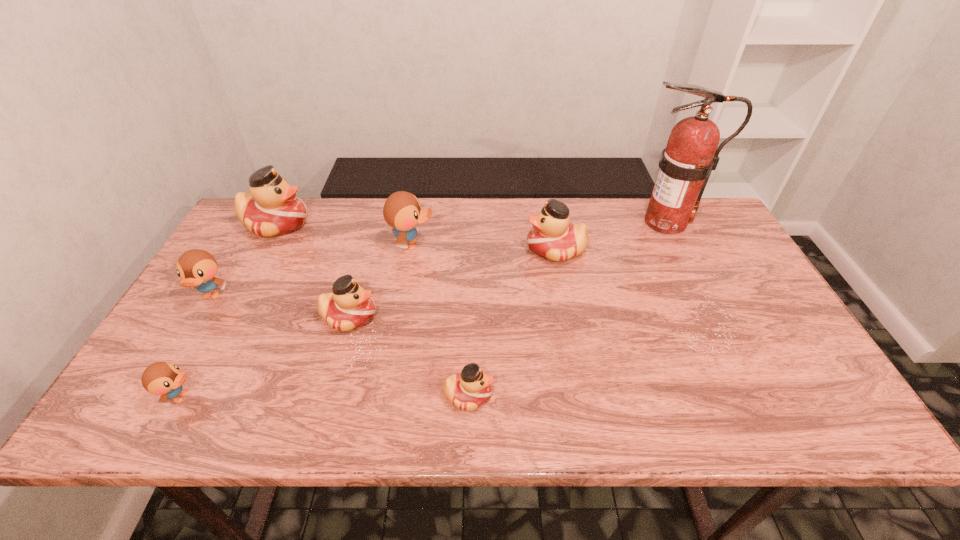
You are a GUI agent. You are given a task and a screenshot of the screen. Output one action in this format:
    pyautogui.click(x=<x>, y=<y>)
    Task: Click on the fire extinguisher
    The image size is (960, 540).
    Given the screenshot: What is the action you would take?
    pyautogui.click(x=691, y=154)

Image resolution: width=960 pixels, height=540 pixels. In order to click on the tallest object in this screenshot , I will do `click(691, 154)`.

At what (x,y) coordinates should I click in order to perform the action: click on the biggest red duck. Please return your answer as a coordinate pair (x, y). The height and width of the screenshot is (540, 960). Looking at the image, I should click on (272, 208).

This screenshot has width=960, height=540. Find the location of `the biggest blue duck`. the biggest blue duck is located at coordinates (402, 211).

Identify the location of the farthest blue duck. This screenshot has height=540, width=960. (402, 211).

Find the location of `the second biggest red duck`. the second biggest red duck is located at coordinates (552, 237).

The width and height of the screenshot is (960, 540). What are the coordinates of `the rightmost red duck` in the screenshot? It's located at (552, 237).

You are a GUI agent. You are given a task and a screenshot of the screen. Output one action in this format:
    pyautogui.click(x=<x>, y=<y>)
    Task: Click on the second farthest blue duck
    
    Given the screenshot: What is the action you would take?
    pyautogui.click(x=197, y=268)

Find the location of a particular element. the second red duck from left to right is located at coordinates (349, 306).

You are a GUI agent. You are given a task and a screenshot of the screen. Output one action in this format:
    pyautogui.click(x=<x>, y=<y>)
    Task: Click on the third biggest red duck
    The image size is (960, 540).
    Given the screenshot: What is the action you would take?
    pyautogui.click(x=349, y=306)